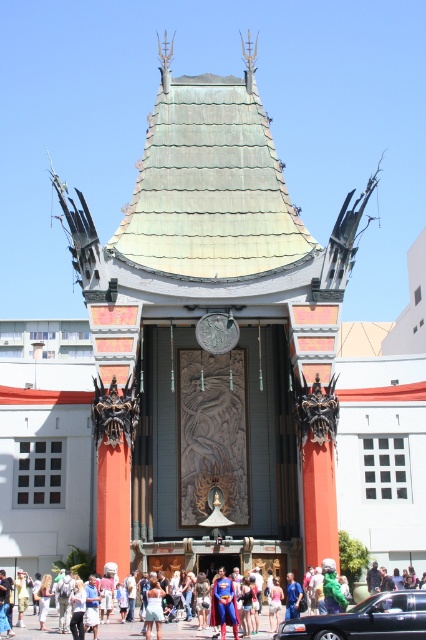
Can you confirm if green tile roof at center is positioned above superman costume at center?

Yes.

Can you confirm if green tile roof at center is thinner than superman costume at center?

In fact, green tile roof at center might be wider than superman costume at center.

Between point (331, 301) and point (406, 605), which one is positioned behind?

The point (331, 301) is behind.

At what (x,y) coordinates should I click in order to perform the action: click on green tile roof at center. Please return your answer as a coordinate pair (x, y). Looking at the image, I should click on (213, 333).

Which is in front, point (183, 268) or point (227, 604)?

Point (227, 604) is more forward.

The width and height of the screenshot is (426, 640). Find the location of `green tile roof at center`. green tile roof at center is located at coordinates (213, 333).

The width and height of the screenshot is (426, 640). In order to click on green tile roof at center in this screenshot , I will do click(x=213, y=333).

Who is shorter, shiny black sedan at center or denim shorts at center?

denim shorts at center is shorter.

Is point (396, 598) positioned behind point (158, 612)?

No, it is in front of (158, 612).

Does point (290, 637) come farther from viewer compared to point (161, 632)?

That is False.

Locate an element on the screen. shiny black sedan at center is located at coordinates 365,620.